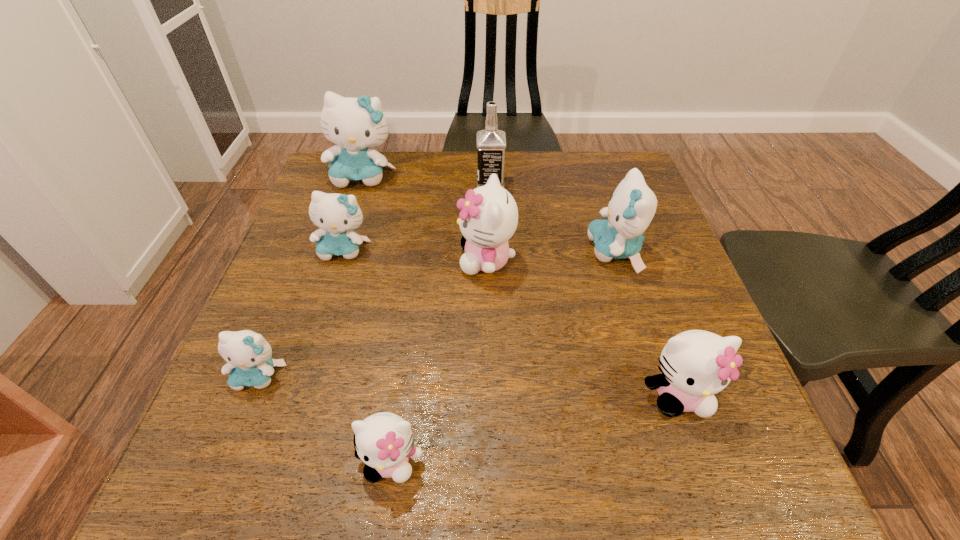
Find the location of a particular element. vacant point located between the second nearest white kitten and the farthest blue kitten is located at coordinates (520, 286).

This screenshot has height=540, width=960. What are the coordinates of `free space between the farthest white kitten and the third biggest blue kitten` in the screenshot? It's located at (416, 255).

Where is `vacant space in between the nearest blue kitten and the vodka`? The image size is (960, 540). vacant space in between the nearest blue kitten and the vodka is located at coordinates (374, 280).

Find the location of a particular element. The height and width of the screenshot is (540, 960). unoccupied area between the smallest blue kitten and the biggest blue kitten is located at coordinates (311, 276).

Image resolution: width=960 pixels, height=540 pixels. Find the location of `object that can be found as the closest to the vodka`. object that can be found as the closest to the vodka is located at coordinates (489, 215).

Identify the location of object that ranks as the second closest to the second smallest white kitten. (489, 215).

Choose which kitten is the third nearest neighbor to the second smallest blue kitten. Please provide its 2D coordinates. Your answer should be formatted as a tuple, i.e. [(x, y)], where the tuple contains the x and y coordinates of a point satisfying the conditions above.

[(248, 354)]

Locate an element on the screen. The width and height of the screenshot is (960, 540). kitten object that ranks as the second closest to the second smallest white kitten is located at coordinates (489, 215).

I want to click on blue kitten that is the third closest to the nearest object, so click(x=632, y=206).

Identify which blue kitten is the third closest to the second white kitten from left to right. Please provide its 2D coordinates. Your answer should be formatted as a tuple, i.e. [(x, y)], where the tuple contains the x and y coordinates of a point satisfying the conditions above.

[(355, 124)]